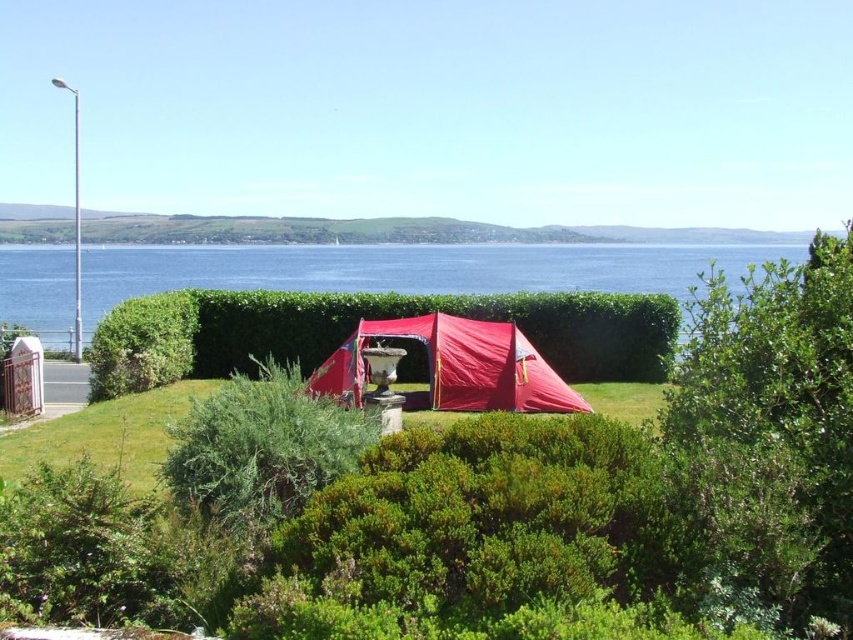
You are setting up a picnic blanket and need to place it between the transparent water at center and the matte red tent at center. According to the scene description, which object should you place the blanket closer to if you want it to be on the left side of the water?

You should place the picnic blanket closer to the matte red tent at center because the transparent water at center is to the right of the matte red tent at center, so the tent is on the left side relative to the water.

You are planning to set up a picnic blanket between the transparent water at center and the matte red tent at center. The picnic blanket is 20 meters long. Will the blanket reach both the water and the tent without overlapping?

The distance between the transparent water at center and the matte red tent at center is 20.76 meters. Since the picnic blanket is only 20 meters long, it will not be long enough to span the entire distance between them without overlapping.

You are planning to set up a picnic blanket between the transparent water at center and the matte red tent at center. Given that the picnic blanket is 3 meters wide, can you fit it between them without overlapping either object?

The transparent water at center is wider than the matte red tent at center. However, the exact distance between them isn not specified in the objects description. Therefore, it is uncertain whether the 3 meter wide picnic blanket can fit without overlapping.